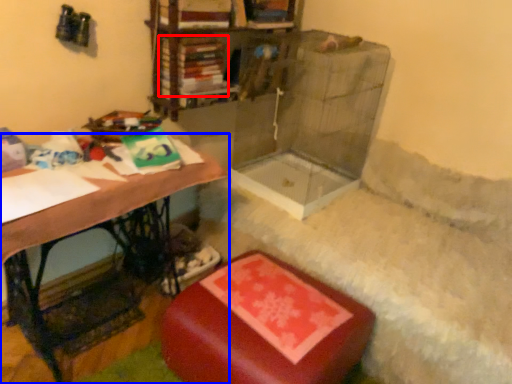
Question: Which point is closer to the camera, book (highlighted by a red box) or table (highlighted by a blue box)?

Choices:
 (A) book
 (B) table

Answer: (B)